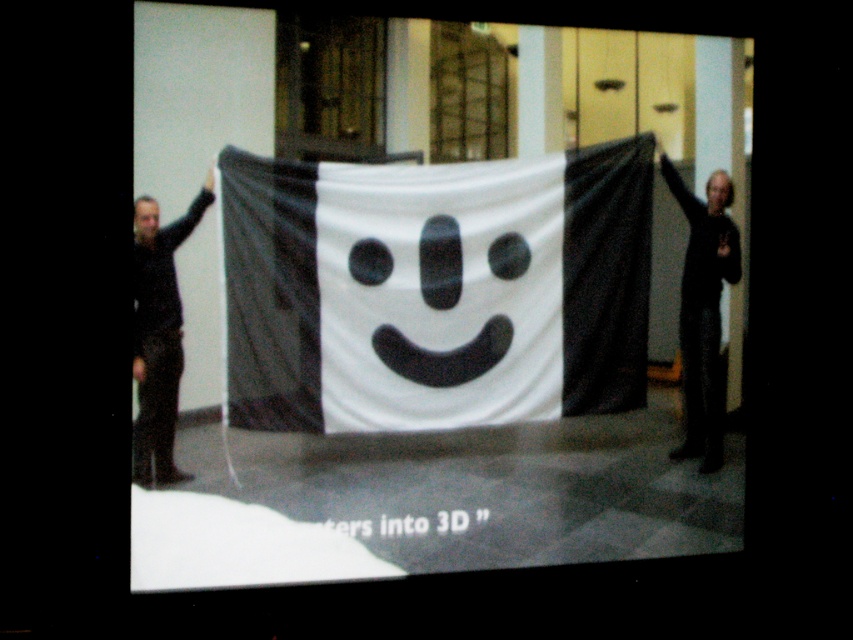
Is black matte sweater at right thinner than black matte clothing at left?

Incorrect, black matte sweater at right's width is not less than black matte clothing at left's.

The width and height of the screenshot is (853, 640). I want to click on black matte sweater at right, so click(x=701, y=321).

The image size is (853, 640). What are the coordinates of `white fabric banner at center` in the screenshot? It's located at (412, 328).

Between point (332, 464) and point (137, 474), which one is positioned in front?

Point (137, 474)

Does point (193, 493) come closer to viewer compared to point (169, 467)?

No, (193, 493) is further to viewer.

Where is `white fabric banner at center`? white fabric banner at center is located at coordinates (412, 328).

This screenshot has width=853, height=640. What do you see at coordinates (412, 328) in the screenshot?
I see `white fabric banner at center` at bounding box center [412, 328].

Does point (521, 129) lie behind point (721, 170)?

No.

Is point (326, 456) behind point (724, 202)?

No, (326, 456) is closer to viewer.

Find the location of a particular element. white fabric banner at center is located at coordinates (412, 328).